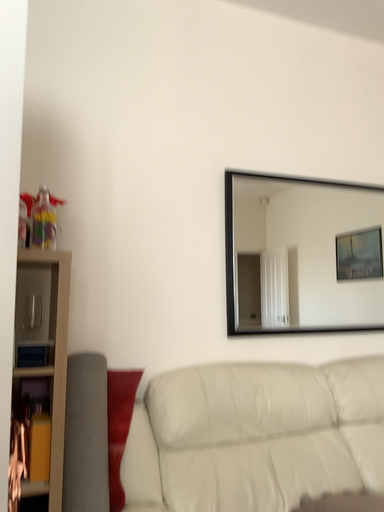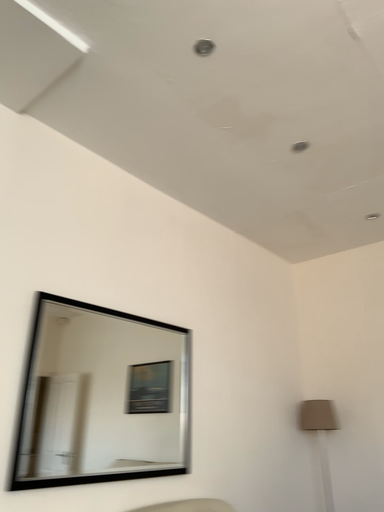
Question: How did the camera likely rotate when shooting the video?

Choices:
 (A) rotated downward
 (B) rotated upward

Answer: (B)